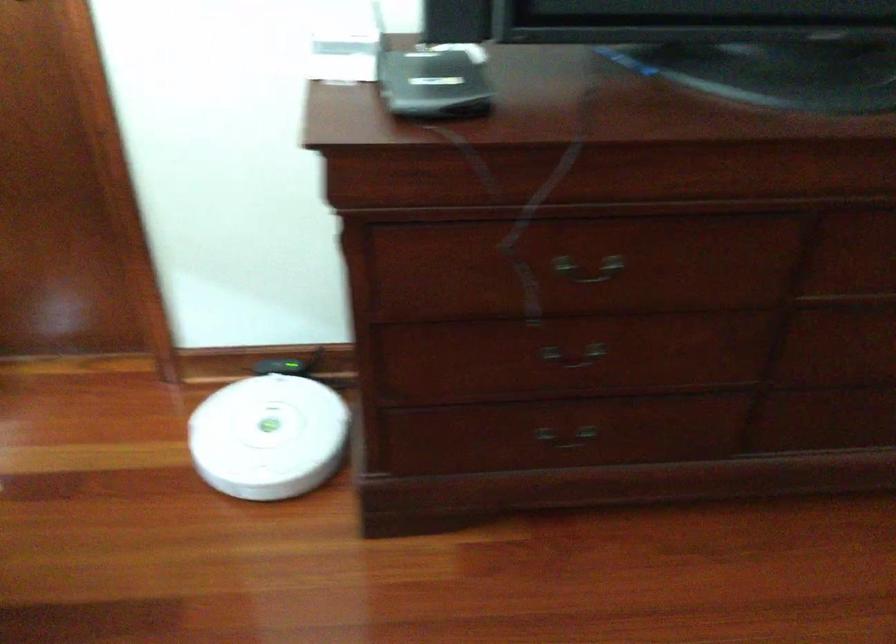
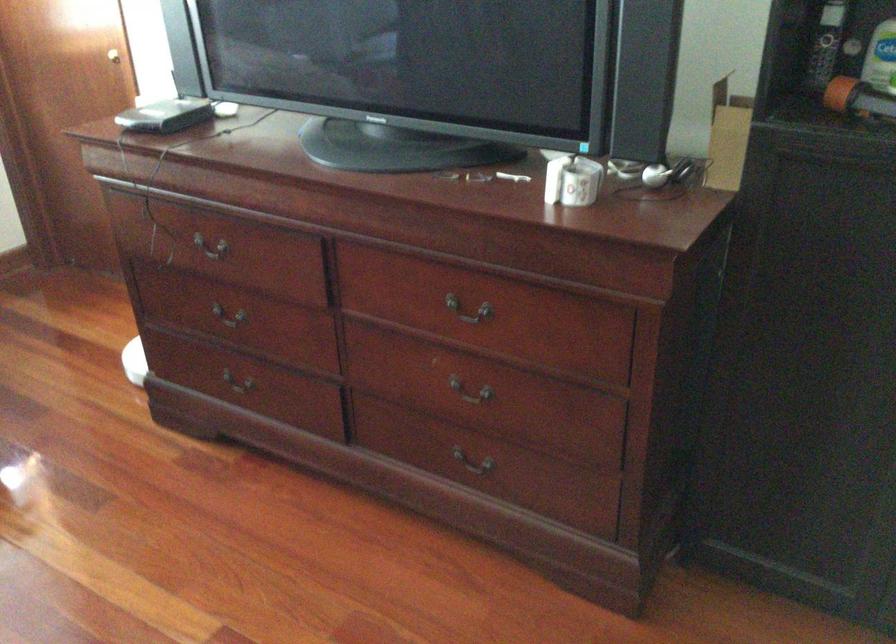
Where in the second image is the point corresponding to (x=521, y=428) from the first image?

(236, 391)